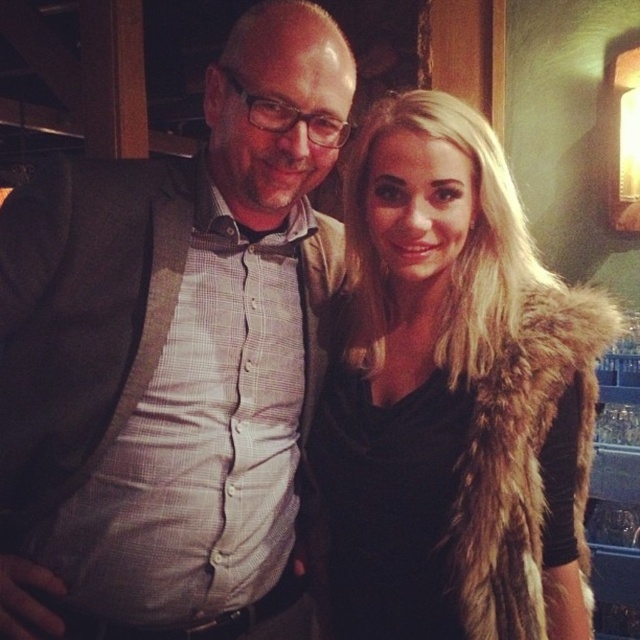
Question: Does matte gray blazer at center appear over fur vest at center?

Choices:
 (A) yes
 (B) no

Answer: (A)

Question: Which of the following is the farthest from the observer?

Choices:
 (A) (161, 291)
 (B) (467, 131)

Answer: (A)

Question: Which point is closer to the camera?

Choices:
 (A) fur vest at center
 (B) matte gray blazer at center

Answer: (B)

Question: Can you confirm if matte gray blazer at center is positioned to the left of fur vest at center?

Choices:
 (A) no
 (B) yes

Answer: (B)

Question: Is matte gray blazer at center wider than fur vest at center?

Choices:
 (A) yes
 (B) no

Answer: (A)